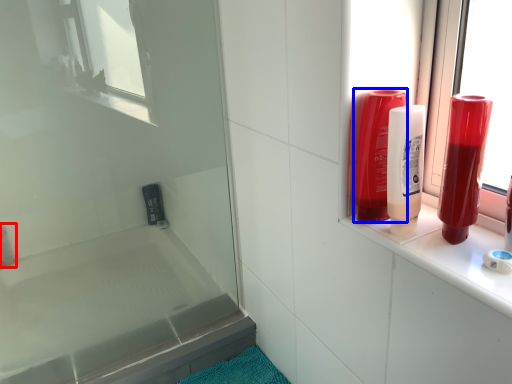
Question: Which object appears farthest to the camera in this image, toiletry (highlighted by a red box) or mouthwash (highlighted by a blue box)?

Choices:
 (A) toiletry
 (B) mouthwash

Answer: (A)